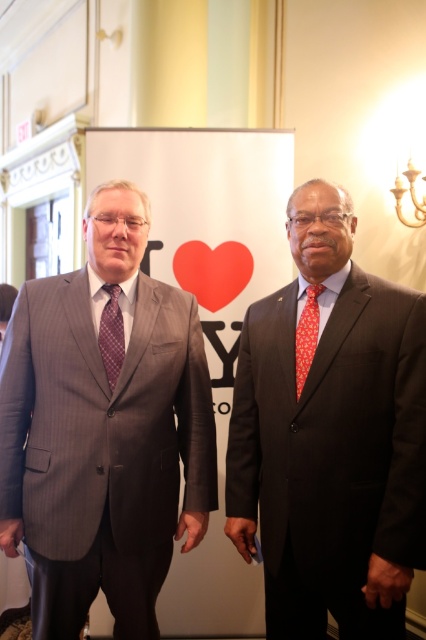
Question: Among these points, which one is farthest from the camera?

Choices:
 (A) (215, 307)
 (B) (307, 308)
 (C) (169, 497)
 (D) (111, 323)

Answer: (A)

Question: Which point is farther from the camera taking this photo?

Choices:
 (A) (307, 432)
 (B) (316, 333)
 (C) (109, 310)

Answer: (C)

Question: Does dark gray suit at right have a greater width compared to orange printed silk tie at right?

Choices:
 (A) no
 (B) yes

Answer: (B)

Question: Where is gray pinstripe suit at left located in relation to red matte heart at center in the image?

Choices:
 (A) below
 (B) above

Answer: (A)

Question: Is red matte heart at center positioned before orange printed silk tie at right?

Choices:
 (A) no
 (B) yes

Answer: (A)

Question: Which point is closer to the camera taking this photo?

Choices:
 (A) (307, 298)
 (B) (114, 316)

Answer: (A)